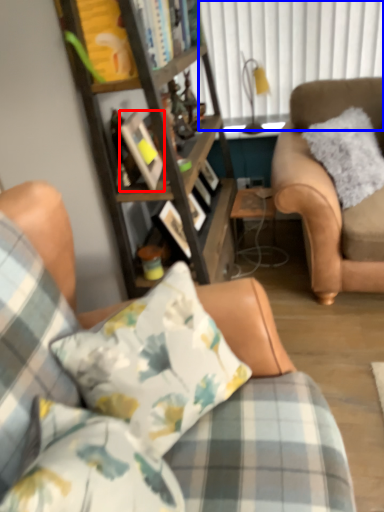
Question: Which object is further to the camera taking this photo, picture frame (highlighted by a red box) or window screen (highlighted by a blue box)?

Choices:
 (A) picture frame
 (B) window screen

Answer: (B)